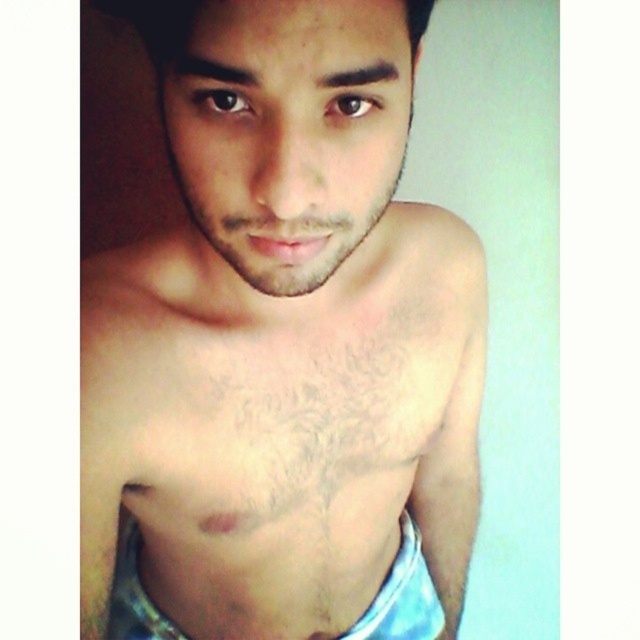
From the picture: Which is below, pale skin at center or blue fabric shorts at center?

blue fabric shorts at center is below.

Who is more distant from viewer, (468,269) or (392,588)?

The point (392,588) is behind.

Is point (305, 376) positioned behind point (355, 636)?

No, (305, 376) is in front of (355, 636).

Find the location of a particular element. Image resolution: width=640 pixels, height=640 pixels. pale skin at center is located at coordinates (282, 346).